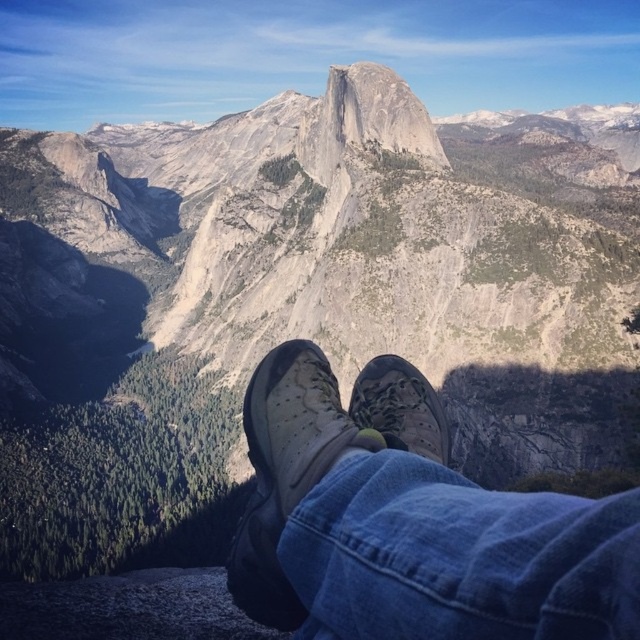
Who is more distant from viewer, (328, 596) or (298, 458)?

Positioned behind is point (298, 458).

Looking at this image, can you confirm if worn leather shoes at center is taller than leather textured shoe at center?

No, worn leather shoes at center is not taller than leather textured shoe at center.

Who is more forward, (524, 506) or (310, 460)?

Point (524, 506) is more forward.

Image resolution: width=640 pixels, height=640 pixels. Find the location of `worn leather shoes at center`. worn leather shoes at center is located at coordinates (410, 522).

Can you confirm if worn leather shoes at center is positioned to the left of camouflage fabric shoe at center?

Yes, worn leather shoes at center is to the left of camouflage fabric shoe at center.

Can you confirm if worn leather shoes at center is positioned above camouflage fabric shoe at center?

No, worn leather shoes at center is not above camouflage fabric shoe at center.

Is point (580, 605) closer to viewer compared to point (436, 440)?

Yes, it is.

Image resolution: width=640 pixels, height=640 pixels. I want to click on worn leather shoes at center, so click(410, 522).

Who is lower down, worn leather shoes at center or gray granite peak at center?

worn leather shoes at center is below.

The image size is (640, 640). I want to click on worn leather shoes at center, so click(x=410, y=522).

Between point (260, 400) and point (381, 147), which one is positioned in front?

Point (260, 400) is in front.

Locate an element on the screen. The height and width of the screenshot is (640, 640). worn leather shoes at center is located at coordinates (410, 522).